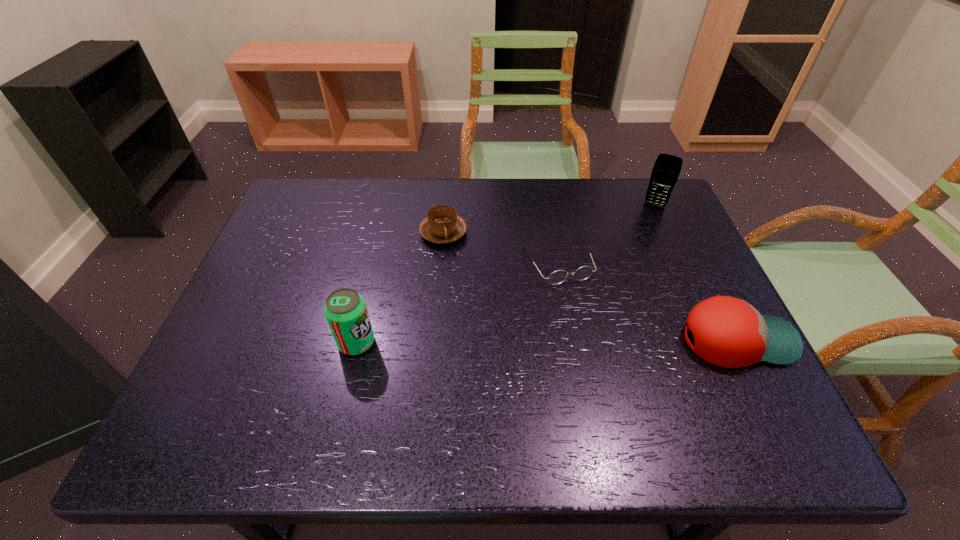
The image size is (960, 540). Identify the location of free space that is in between the shortest object and the cellular telephone. (606, 233).

At what (x,y) coordinates should I click in order to perform the action: click on empty space that is in between the fourth shortest object and the farthest object. Please return your answer as a coordinate pair (x, y). Looking at the image, I should click on (506, 274).

I want to click on vacant region between the pop soda and the baseball cap, so click(546, 341).

At what (x,y) coordinates should I click in order to perform the action: click on vacant area that lies between the third object from left to right and the third tallest object. Please return your answer as a coordinate pair (x, y). Looking at the image, I should click on point(647,301).

Identify the location of free spot between the baseball cap and the leftmost object. Image resolution: width=960 pixels, height=540 pixels. (546, 341).

At what (x,y) coordinates should I click in order to perform the action: click on free area in between the third shortest object and the spectacles. Please return your answer as a coordinate pair (x, y). Looking at the image, I should click on (647, 301).

What are the coordinates of `unoccupied position between the farthest object and the third object from left to right` in the screenshot? It's located at (606, 233).

Where is `vacant area between the third object from right to left and the pop soda`? vacant area between the third object from right to left and the pop soda is located at coordinates (x=457, y=302).

Locate an element on the screen. free space between the leftmost object and the third object from right to left is located at coordinates (457, 302).

The image size is (960, 540). Find the location of `free spot between the baseball cap and the cellular telephone`. free spot between the baseball cap and the cellular telephone is located at coordinates (696, 273).